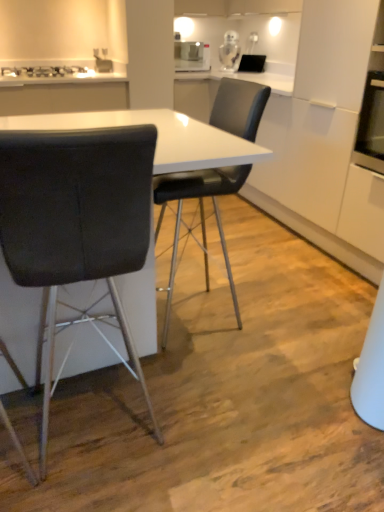
This screenshot has height=512, width=384. Identify the location of free area behind black leather chair at center, which is the 1th chair from right to left. (219, 269).